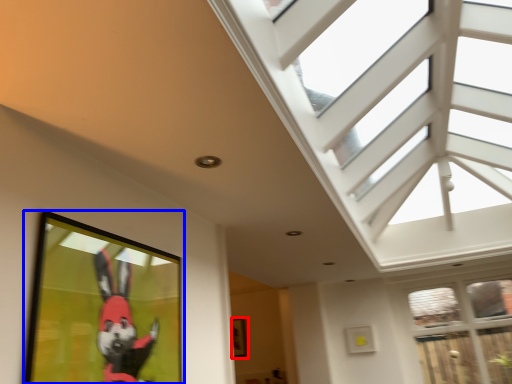
Question: Which object is closer to the camera taking this photo, picture frame (highlighted by a red box) or picture frame (highlighted by a blue box)?

Choices:
 (A) picture frame
 (B) picture frame

Answer: (B)